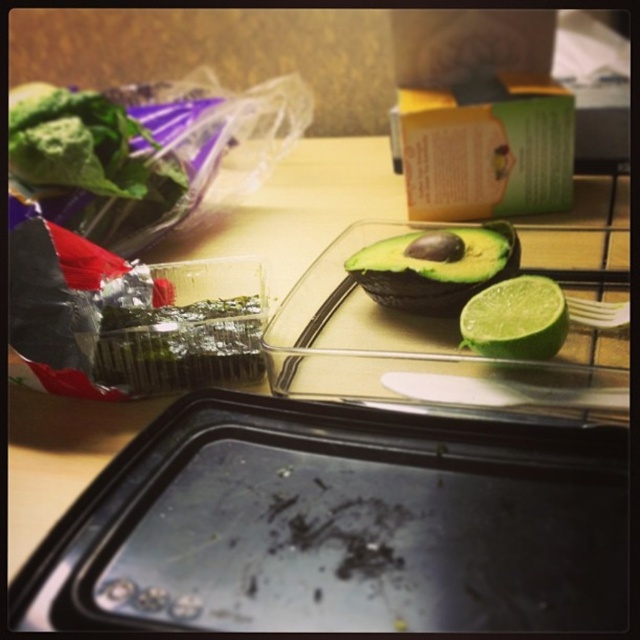
Question: Which object is the farthest from the transparent glass avocado at center?

Choices:
 (A) green matte lime at center
 (B) black matte tray at center
 (C) green leafy vegetable at upper left

Answer: (C)

Question: Based on their relative distances, which object is farther from the black matte tray at center?

Choices:
 (A) green matte lime at center
 (B) green leafy vegetable at upper left
 (C) green matte avocado at center

Answer: (B)

Question: Is black matte tray at center bigger than green matte avocado at center?

Choices:
 (A) yes
 (B) no

Answer: (A)

Question: Is black matte tray at center bigger than green leafy vegetable at upper left?

Choices:
 (A) no
 (B) yes

Answer: (A)

Question: Does green leafy vegetable at upper left appear over green matte avocado at center?

Choices:
 (A) no
 (B) yes

Answer: (B)

Question: Among these objects, which one is farthest from the camera?

Choices:
 (A) green leafy vegetable at upper left
 (B) green matte lime at center

Answer: (A)